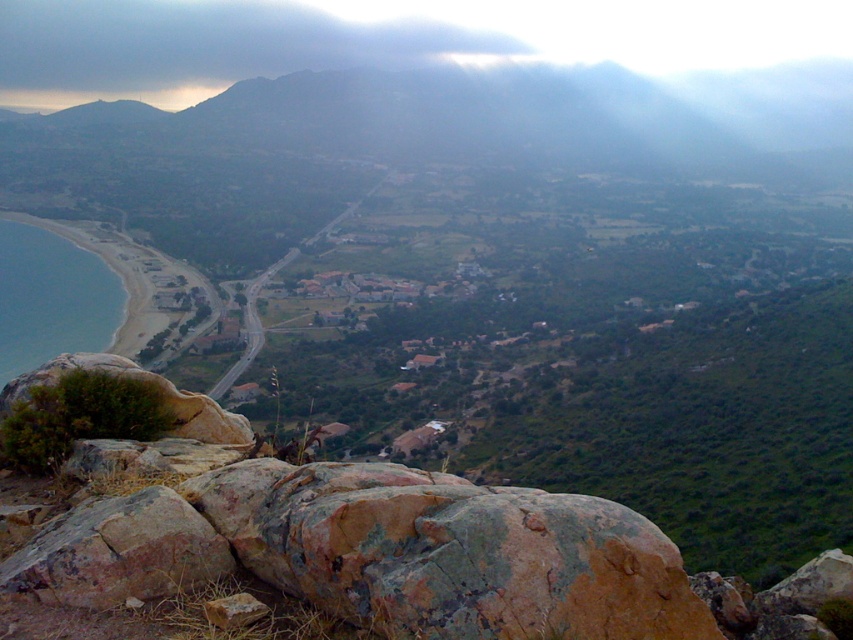
Question: Where is rusty stone boulder at lower left located in relation to translucent blue water at lower left in the image?

Choices:
 (A) left
 (B) right

Answer: (B)

Question: Is rusty stone boulder at lower left positioned in front of translucent blue water at lower left?

Choices:
 (A) no
 (B) yes

Answer: (B)

Question: Observing the image, what is the correct spatial positioning of rusty stone boulder at lower left in reference to translucent blue water at lower left?

Choices:
 (A) above
 (B) below

Answer: (B)